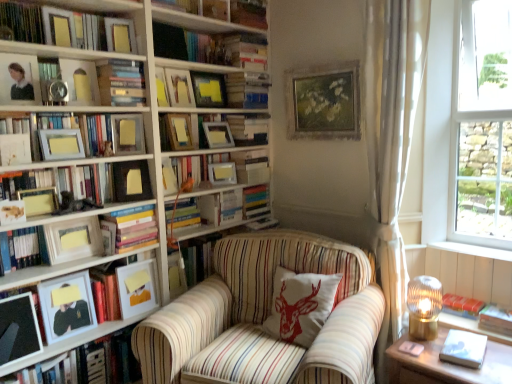
Question: From the image's perspective, relative to hardcover books at center, the ninth book when ordered from bottom to top, is matte gold picture frame at upper left, the seventh picture frame viewed from the left, above or below?

Choices:
 (A) below
 (B) above

Answer: (B)

Question: Is point (56, 14) closer or farther from the camera than point (256, 228)?

Choices:
 (A) closer
 (B) farther

Answer: (A)

Question: Estimate the real-world distances between objects in this image. Which object is farther from the matte white picture frame at left, the 10th picture frame when ordered from right to left?

Choices:
 (A) matte yellow picture frame at upper center, which is the 15th picture frame from left to right
 (B) white sheer curtain at right
 (C) white wood window sill at right
 (D) matte black frame at left, marked as the tenth book in a bottom-to-top arrangement
 (E) matte wooden book at upper center, which appears as the 11th book when ordered from the bottom

Answer: (C)

Question: Which of these objects is positioned closest to the white wood window sill at right?

Choices:
 (A) hardcover book at left, the thirteenth book positioned from the top
 (B) matte yellow picture frame at upper left, the eighth picture frame from the right
 (C) hardcover books at left, marked as the 8th book in a bottom-to-top arrangement
 (D) matte wooden picture frame at upper center, the fourteenth picture frame positioned from the left
 (E) matte wooden picture frame at upper center, marked as the fifth picture frame in a right-to-left arrangement

Answer: (D)